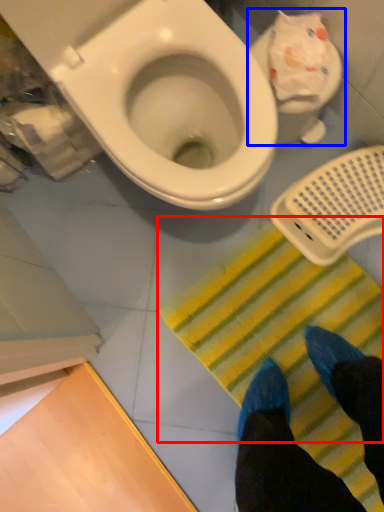
Question: Among these objects, which one is nearest to the camera, doormat (highlighted by a red box) or toilet (highlighted by a blue box)?

Choices:
 (A) doormat
 (B) toilet

Answer: (B)